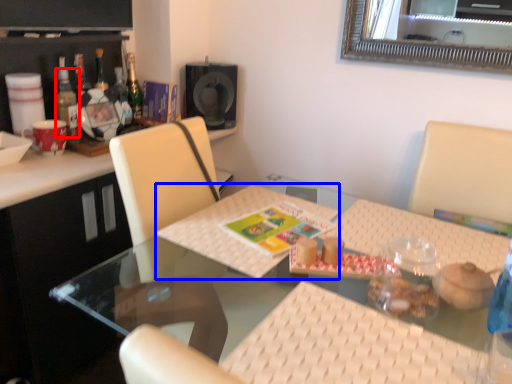
Question: Which point is closer to the camera, bottle (highlighted by a red box) or place mat (highlighted by a blue box)?

Choices:
 (A) bottle
 (B) place mat

Answer: (B)